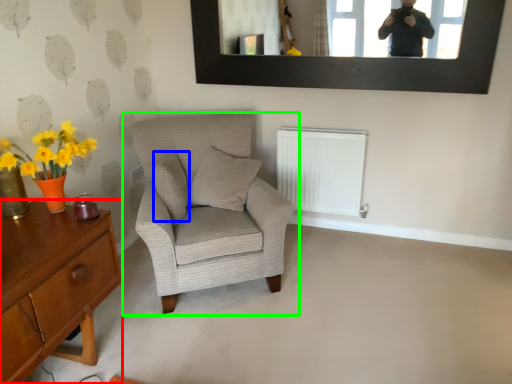
Question: Estimate the real-world distances between objects in this image. Which object is farther from desk (highlighted by a red box), pillow (highlighted by a blue box) or chair (highlighted by a green box)?

Choices:
 (A) pillow
 (B) chair

Answer: (A)